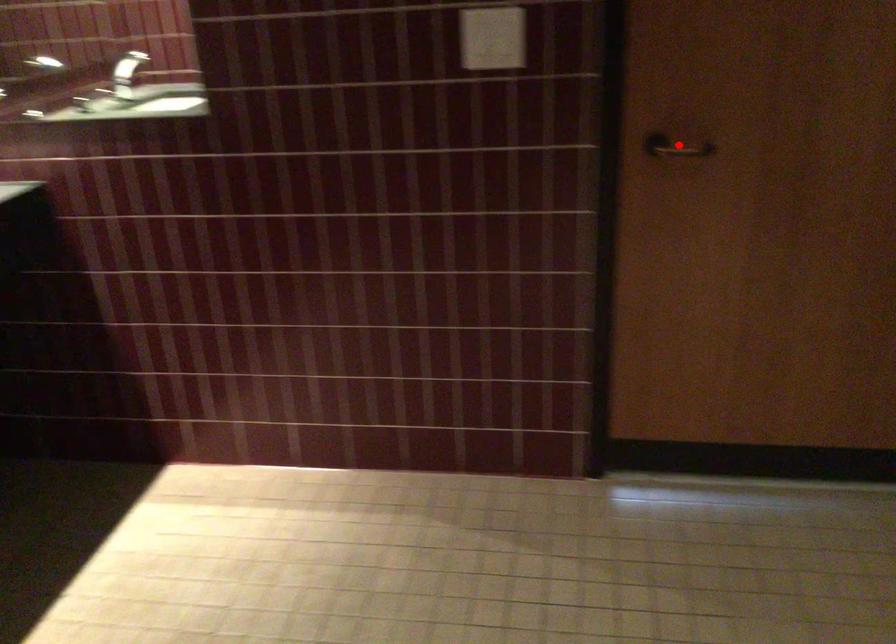
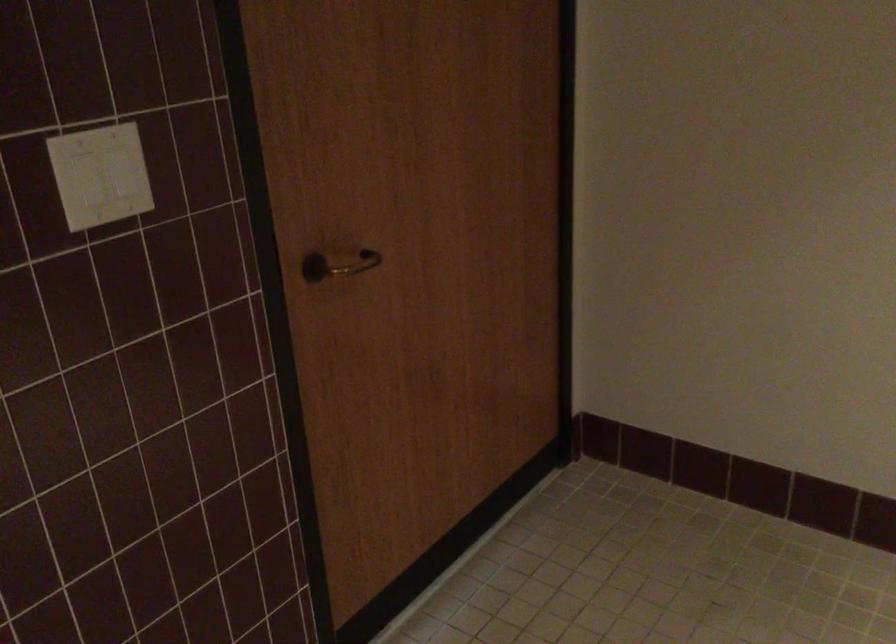
Question: A red point is marked in image1. In image2, is the corresponding 3D point closer to the camera or farther? Reply with the corresponding letter.

Choices:
 (A) The corresponding 3D point is closer.
 (B) The corresponding 3D point is farther.

Answer: (A)